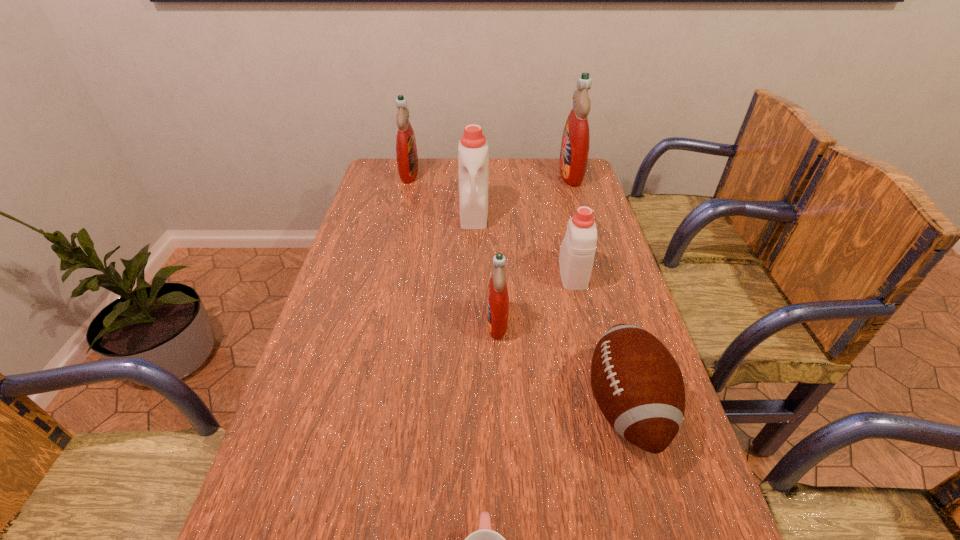
This screenshot has height=540, width=960. What are the coordinates of `free region located on the front surface of the smallest red detergent` in the screenshot? It's located at (401, 322).

You are a GUI agent. You are given a task and a screenshot of the screen. Output one action in this format:
    pyautogui.click(x=<x>, y=<y>)
    Task: Click on the free space located on the front surface of the smallest red detergent
    
    Given the screenshot: What is the action you would take?
    pyautogui.click(x=370, y=322)

Find the location of `vacant space located on the front surface of the smallest red detergent`. vacant space located on the front surface of the smallest red detergent is located at coordinates (417, 322).

Locate an element on the screen. This screenshot has height=540, width=960. vacant space situated 0.220m on the laces of the sixth tallest object is located at coordinates (484, 406).

The height and width of the screenshot is (540, 960). I want to click on vacant space located 0.140m on the laces of the sixth tallest object, so click(x=521, y=406).

You are a GUI agent. You are given a task and a screenshot of the screen. Output one action in this format:
    pyautogui.click(x=<x>, y=<y>)
    Task: Click on the vacant area situated on the laces of the sixth tallest object
    The height and width of the screenshot is (540, 960).
    Given the screenshot: What is the action you would take?
    pyautogui.click(x=420, y=406)

Identify the location of object that is at the left edge. The image size is (960, 540). (406, 149).

Where is `football that is positioned at the right edge`? football that is positioned at the right edge is located at coordinates tap(637, 384).

The width and height of the screenshot is (960, 540). What are the coordinates of `object that is positioned at the far left corner` in the screenshot? It's located at (406, 149).

Find the location of a particular element. This screenshot has height=540, width=960. object that is positioned at the far right corner is located at coordinates [x=574, y=152].